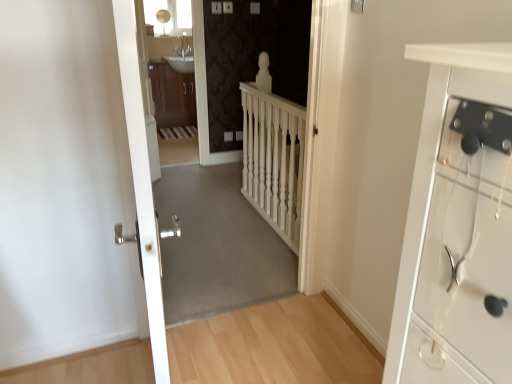
Find the location of a particular element. Image resolution: width=512 pixels, height=384 pixels. unoccupied space behind white metallic door at center is located at coordinates (211, 337).